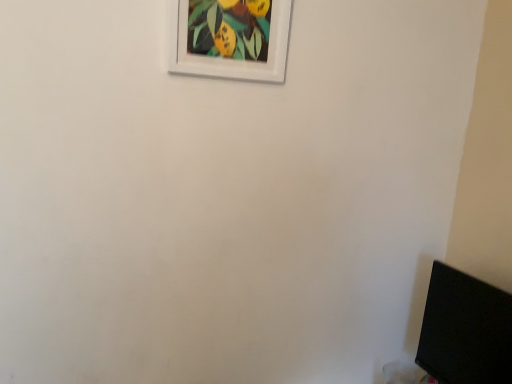
Question: Is white matte picture frame at upper center taller or shorter than black matte computer monitor at lower right?

Choices:
 (A) tall
 (B) short

Answer: (B)

Question: From a real-world perspective, is white matte picture frame at upper center physically located above or below black matte computer monitor at lower right?

Choices:
 (A) below
 (B) above

Answer: (B)

Question: From the image's perspective, is white matte picture frame at upper center above or below black matte computer monitor at lower right?

Choices:
 (A) above
 (B) below

Answer: (A)

Question: In the image, is black matte computer monitor at lower right positioned in front of or behind white matte picture frame at upper center?

Choices:
 (A) behind
 (B) front

Answer: (B)

Question: Is black matte computer monitor at lower right taller or shorter than white matte picture frame at upper center?

Choices:
 (A) tall
 (B) short

Answer: (A)

Question: From a real-world perspective, is black matte computer monitor at lower right positioned above or below white matte picture frame at upper center?

Choices:
 (A) above
 (B) below

Answer: (B)

Question: Is black matte computer monitor at lower right bigger or smaller than white matte picture frame at upper center?

Choices:
 (A) small
 (B) big

Answer: (B)